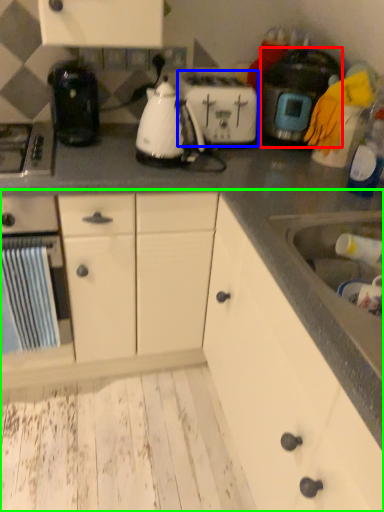
Question: Which object is the farthest from kitchen appliance (highlighted by a red box)? Choose among these: toaster (highlighted by a blue box) or cabinetry (highlighted by a green box).

Choices:
 (A) toaster
 (B) cabinetry

Answer: (B)